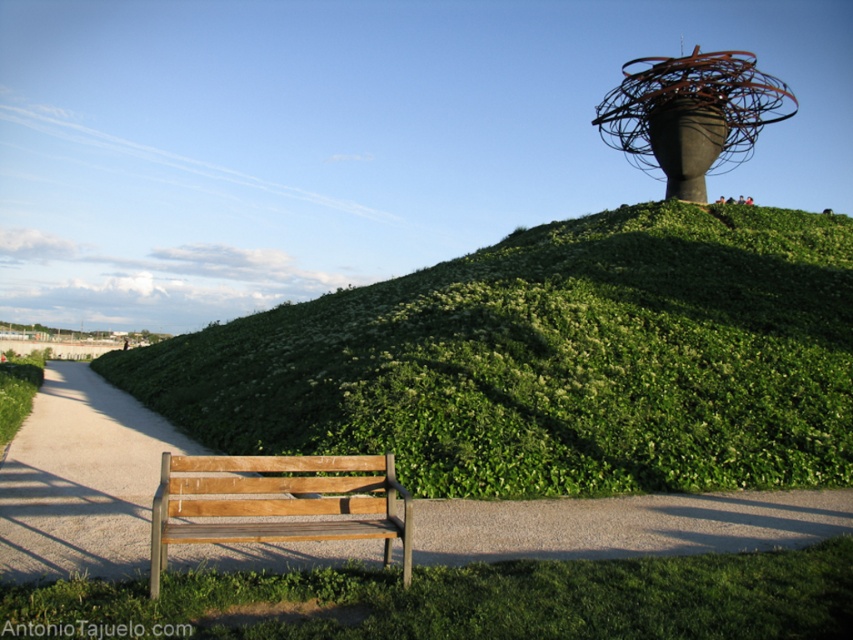
Question: Can you confirm if green grass at lower center is thinner than wooden park bench at lower left?

Choices:
 (A) yes
 (B) no

Answer: (A)

Question: Which object is the closest to the wooden park bench at lower left?

Choices:
 (A) green grassy hillside at upper center
 (B) green grass at lower center

Answer: (B)

Question: Can you confirm if green grass at lower center is positioned to the right of wooden park bench at lower left?

Choices:
 (A) yes
 (B) no

Answer: (B)

Question: Which point is farther to the camera?

Choices:
 (A) wooden park bench at lower left
 (B) green grass at lower center

Answer: (A)

Question: Considering the real-world distances, which object is closest to the wooden park bench at lower left?

Choices:
 (A) green grass at lower center
 (B) green grassy hillside at upper center

Answer: (A)

Question: Can you confirm if green grass at lower center is wider than wooden park bench at lower left?

Choices:
 (A) no
 (B) yes

Answer: (A)